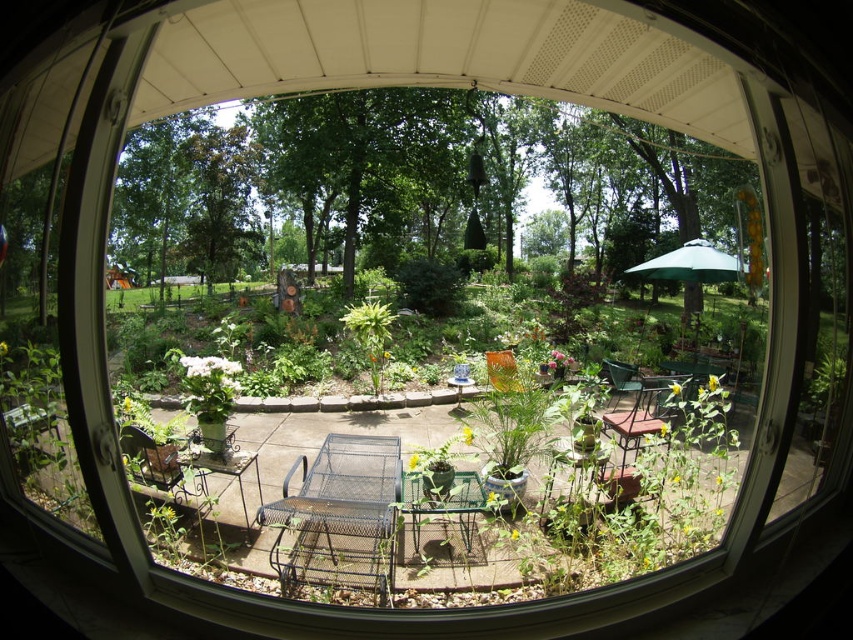
Question: Considering the real-world distances, which object is closest to the metallic brown chair at lower left?

Choices:
 (A) green wire chair at center
 (B) orange fabric chair at center
 (C) brown metal chair at center

Answer: (A)

Question: Does metallic brown chair at lower left have a greater width compared to orange fabric chair at center?

Choices:
 (A) no
 (B) yes

Answer: (A)

Question: Does metallic brown chair at lower left have a smaller size compared to green metal chair at center?

Choices:
 (A) no
 (B) yes

Answer: (B)

Question: Among these objects, which one is farthest from the camera?

Choices:
 (A) green metal chair at center
 (B) orange fabric chair at center
 (C) brown metal chair at center
 (D) green wire chair at center

Answer: (A)

Question: Is metallic brown chair at lower left positioned in front of green metal chair at center?

Choices:
 (A) no
 (B) yes

Answer: (B)

Question: Considering the real-world distances, which object is farthest from the metal mesh chair at center?

Choices:
 (A) green wire chair at center
 (B) brown metal chair at center
 (C) green metal chair at center

Answer: (C)